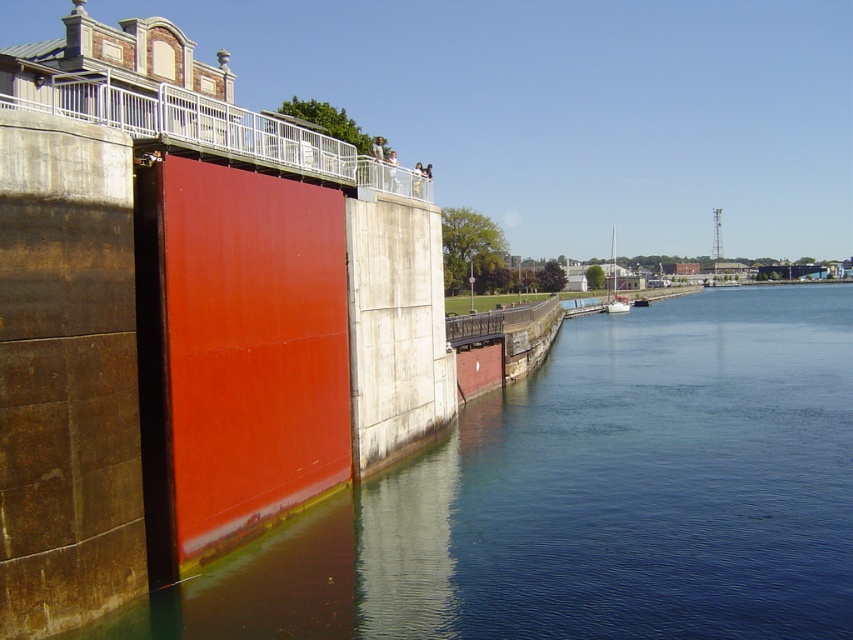
Question: Which of the following is the farthest from the observer?

Choices:
 (A) white matte sailboat at center-right
 (B) smooth concrete wall at left

Answer: (A)

Question: Is smooth concrete wall at left wider than white matte sailboat at center-right?

Choices:
 (A) yes
 (B) no

Answer: (A)

Question: Where is smooth concrete wall at left located in relation to white matte sailboat at center-right in the image?

Choices:
 (A) left
 (B) right

Answer: (A)

Question: Which object is farther from the camera taking this photo?

Choices:
 (A) white matte sailboat at center-right
 (B) smooth concrete wall at left

Answer: (A)

Question: In this image, where is smooth concrete wall at left located relative to white matte sailboat at center-right?

Choices:
 (A) below
 (B) above

Answer: (A)